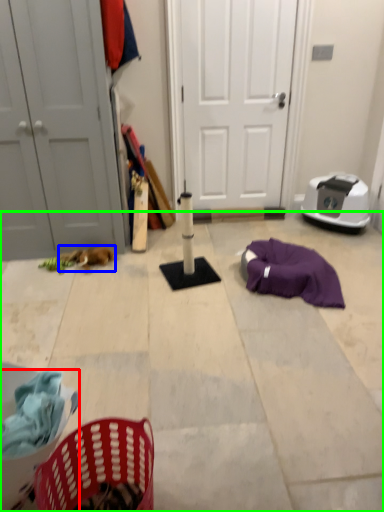
Question: Which object is the closest to the basket (highlighted by a red box)? Choose among these: animal (highlighted by a blue box) or concrete (highlighted by a green box).

Choices:
 (A) animal
 (B) concrete

Answer: (B)